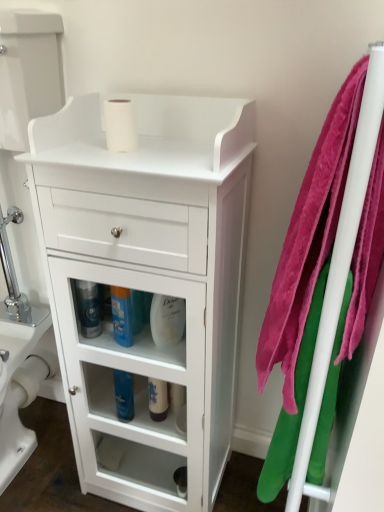
Measure the distance between point (150, 397) and camera.

Point (150, 397) and camera are 4.09 feet apart.

What do you see at coordinates (121, 315) in the screenshot?
I see `blue glossy bottle at center, the 3th cleaning product when ordered from left to right` at bounding box center [121, 315].

Where is `translucent plastic bottle at lower left, the fifth cleaning product viewed from the right`? The image size is (384, 512). translucent plastic bottle at lower left, the fifth cleaning product viewed from the right is located at coordinates (88, 308).

This screenshot has width=384, height=512. What do you see at coordinates (19, 392) in the screenshot?
I see `white glossy toilet bowl at lower left` at bounding box center [19, 392].

Identify the location of white glossy toilet bowl at lower left. The height and width of the screenshot is (512, 384). (19, 392).

Find the location of a particular element. white glossy bottle at center, which is the 4th cleaning product from left to right is located at coordinates (158, 399).

From the image's perspective, is white glossy bottle at center, acting as the 5th cleaning product starting from the left, above or below translucent plastic bottle at lower left, which is counted as the first cleaning product, starting from the left?

Clearly, from the image's perspective, white glossy bottle at center, acting as the 5th cleaning product starting from the left, is below translucent plastic bottle at lower left, which is counted as the first cleaning product, starting from the left.

Is the position of white glossy bottle at center, positioned as the 1th cleaning product in right-to-left order, more distant than that of translucent plastic bottle at lower left, the fifth cleaning product viewed from the right?

That is False.

Is white glossy bottle at center, positioned as the 1th cleaning product in right-to-left order, positioned beyond the bounds of translucent plastic bottle at lower left, which is counted as the first cleaning product, starting from the left?

Absolutely, white glossy bottle at center, positioned as the 1th cleaning product in right-to-left order, is external to translucent plastic bottle at lower left, which is counted as the first cleaning product, starting from the left.

Does white glossy bottle at center, positioned as the 1th cleaning product in right-to-left order, have a greater height compared to translucent plastic bottle at lower left, the fifth cleaning product viewed from the right?

Correct, white glossy bottle at center, positioned as the 1th cleaning product in right-to-left order, is much taller as translucent plastic bottle at lower left, the fifth cleaning product viewed from the right.

Is point (133, 135) farther from viewer compared to point (120, 315)?

That is False.

At what (x,y) coordinates should I click in order to perform the action: click on toilet paper on the right of blue glossy bottle at center, which is counted as the 3th cleaning product, starting from the right. Please return your answer as a coordinate pair (x, y). The image size is (384, 512). Looking at the image, I should click on (120, 125).

Who is shorter, white matte toilet paper at upper center, which ranks as the 2th toilet paper in left-to-right order, or blue glossy bottle at center, which is counted as the 3th cleaning product, starting from the right?

With less height is white matte toilet paper at upper center, which ranks as the 2th toilet paper in left-to-right order.

Based on their positions, is white matte toilet paper at upper center, which appears as the 1th toilet paper when viewed from the right, located to the left or right of blue glossy bottle at center, the 3th cleaning product when ordered from left to right?

In the image, white matte toilet paper at upper center, which appears as the 1th toilet paper when viewed from the right, appears on the right side of blue glossy bottle at center, the 3th cleaning product when ordered from left to right.

Between blue glossy bottle at center, the 3th cleaning product when ordered from left to right, and white glossy toilet bowl at lower left, which one has smaller width?

With smaller width is blue glossy bottle at center, the 3th cleaning product when ordered from left to right.

Would you say white glossy toilet bowl at lower left is part of blue glossy bottle at center, which is counted as the 3th cleaning product, starting from the right,'s contents?

No, white glossy toilet bowl at lower left is located outside of blue glossy bottle at center, which is counted as the 3th cleaning product, starting from the right.

From a real-world perspective, who is located higher, blue glossy bottle at center, which is counted as the 3th cleaning product, starting from the right, or white glossy toilet bowl at lower left?

blue glossy bottle at center, which is counted as the 3th cleaning product, starting from the right.

Based on the photo, is blue glossy bottle at center, which is counted as the 3th cleaning product, starting from the right, aimed at white glossy toilet bowl at lower left?

No.

Is blue glossy bottle at lower center, which ranks as the 4th cleaning product in right-to-left order, positioned far away from white glossy toilet bowl at lower left?

Actually, blue glossy bottle at lower center, which ranks as the 4th cleaning product in right-to-left order, and white glossy toilet bowl at lower left are a little close together.

Does blue glossy bottle at lower center, the second cleaning product positioned from the left, have a greater height compared to white glossy toilet bowl at lower left?

No.

Considering the relative positions of blue glossy bottle at lower center, the second cleaning product positioned from the left, and white glossy toilet bowl at lower left in the image provided, is blue glossy bottle at lower center, the second cleaning product positioned from the left, to the left of white glossy toilet bowl at lower left from the viewer's perspective?

No.

Looking at this image, from the image's perspective, which one is positioned higher, blue glossy bottle at lower center, which ranks as the 4th cleaning product in right-to-left order, or white glossy toilet bowl at lower left?

From the image's view, blue glossy bottle at lower center, which ranks as the 4th cleaning product in right-to-left order, is above.

Considering the sizes of objects pink plush towel at right, the first bath towel viewed from the right, and white glossy bottle at center, positioned as the 1th cleaning product in right-to-left order, in the image provided, who is wider, pink plush towel at right, the first bath towel viewed from the right, or white glossy bottle at center, positioned as the 1th cleaning product in right-to-left order,?

pink plush towel at right, the first bath towel viewed from the right, is wider.

From a real-world perspective, between pink plush towel at right, the first bath towel viewed from the right, and white glossy bottle at center, positioned as the 1th cleaning product in right-to-left order, who is vertically higher?

pink plush towel at right, the first bath towel viewed from the right.

Is pink plush towel at right, which is the 2th bath towel in left-to-right order, to the right of white glossy bottle at center, acting as the 5th cleaning product starting from the left, from the viewer's perspective?

Yes, pink plush towel at right, which is the 2th bath towel in left-to-right order, is to the right of white glossy bottle at center, acting as the 5th cleaning product starting from the left.

Which of these two, blue glossy bottle at center, which is counted as the 3th cleaning product, starting from the right, or white glossy bottle at center, which is the 4th cleaning product from left to right, is thinner?

Thinner between the two is white glossy bottle at center, which is the 4th cleaning product from left to right.

Does blue glossy bottle at center, the 3th cleaning product when ordered from left to right, come in front of white glossy bottle at center, the second cleaning product positioned from the right?

Yes, blue glossy bottle at center, the 3th cleaning product when ordered from left to right, is closer to the viewer.

Consider the image. Is blue glossy bottle at center, the 3th cleaning product when ordered from left to right, oriented towards white glossy bottle at center, the second cleaning product positioned from the right?

No, blue glossy bottle at center, the 3th cleaning product when ordered from left to right, is not turned towards white glossy bottle at center, the second cleaning product positioned from the right.

Based on the photo, considering the relative sizes of velvety pink towel at right, which is counted as the second bath towel, starting from the right, and blue glossy bottle at center, which is counted as the 3th cleaning product, starting from the right, in the image provided, is velvety pink towel at right, which is counted as the second bath towel, starting from the right, smaller than blue glossy bottle at center, which is counted as the 3th cleaning product, starting from the right,?

No, velvety pink towel at right, which is counted as the second bath towel, starting from the right, is not smaller than blue glossy bottle at center, which is counted as the 3th cleaning product, starting from the right.

Could you tell me if velvety pink towel at right, which is counted as the second bath towel, starting from the right, is turned towards blue glossy bottle at center, which is counted as the 3th cleaning product, starting from the right?

Yes.

Based on the photo, is velvety pink towel at right, which is counted as the second bath towel, starting from the right, positioned before blue glossy bottle at center, which is counted as the 3th cleaning product, starting from the right?

That is True.

From the image's perspective, between velvety pink towel at right, which is counted as the second bath towel, starting from the right, and blue glossy bottle at center, which is counted as the 3th cleaning product, starting from the right, which one is located above?

blue glossy bottle at center, which is counted as the 3th cleaning product, starting from the right, is shown above in the image.

Locate an element on the screen. The height and width of the screenshot is (512, 384). cleaning product that is above the white glossy bottle at center, acting as the 5th cleaning product starting from the left (from the image's perspective) is located at coordinates (88, 308).

Locate an element on the screen. The height and width of the screenshot is (512, 384). the 2nd cleaning product behind when counting from the white matte toilet paper at upper center, which appears as the 1th toilet paper when viewed from the right is located at coordinates (121, 315).

When comparing their distances from white glossy bottle at center, acting as the 5th cleaning product starting from the left, does blue glossy bottle at center, which is counted as the 3th cleaning product, starting from the right, or white glossy bottle at center, which is the 4th cleaning product from left to right, seem further?

white glossy bottle at center, which is the 4th cleaning product from left to right, lies further to white glossy bottle at center, acting as the 5th cleaning product starting from the left, than the other object.

From the image, which object appears to be farther from blue glossy bottle at lower center, which ranks as the 4th cleaning product in right-to-left order, white glossy bottle at center, which is the 4th cleaning product from left to right, or velvety pink towel at right, which is counted as the second bath towel, starting from the right?

Based on the image, velvety pink towel at right, which is counted as the second bath towel, starting from the right, appears to be further to blue glossy bottle at lower center, which ranks as the 4th cleaning product in right-to-left order.

Which object lies further to the anchor point translucent plastic bottle at lower left, which is counted as the first cleaning product, starting from the left, blue glossy bottle at lower center, the second cleaning product positioned from the left, or white matte toilet paper at lower center, acting as the second toilet paper starting from the right?

Among the two, white matte toilet paper at lower center, acting as the second toilet paper starting from the right, is located further to translucent plastic bottle at lower left, which is counted as the first cleaning product, starting from the left.

From the picture: Looking at the image, which one is located closer to translucent plastic bottle at lower left, which is counted as the first cleaning product, starting from the left, pink plush towel at right, which is the 2th bath towel in left-to-right order, or white matte toilet paper at upper center, which appears as the 1th toilet paper when viewed from the right?

white matte toilet paper at upper center, which appears as the 1th toilet paper when viewed from the right, lies closer to translucent plastic bottle at lower left, which is counted as the first cleaning product, starting from the left, than the other object.

Considering their positions, is white matte toilet paper at upper center, marked as the 1th toilet paper in a top-to-bottom arrangement, positioned further to translucent plastic bottle at lower left, the fifth cleaning product viewed from the right, than white matte toilet paper at lower center, arranged as the second toilet paper when viewed from the front?

white matte toilet paper at lower center, arranged as the second toilet paper when viewed from the front.

Looking at the image, which one is located further to white glossy toilet bowl at lower left, blue glossy bottle at lower center, the second cleaning product positioned from the left, or translucent plastic bottle at lower left, which is counted as the first cleaning product, starting from the left?

translucent plastic bottle at lower left, which is counted as the first cleaning product, starting from the left.

Based on their spatial positions, is translucent plastic bottle at lower left, which is counted as the first cleaning product, starting from the left, or pink plush towel at right, which is the 2th bath towel in left-to-right order, closer to white glossy bottle at center, which is the 4th cleaning product from left to right?

The object closer to white glossy bottle at center, which is the 4th cleaning product from left to right, is translucent plastic bottle at lower left, which is counted as the first cleaning product, starting from the left.

Looking at the image, which one is located closer to blue glossy bottle at center, the 3th cleaning product when ordered from left to right, white glossy bottle at center, positioned as the 1th cleaning product in right-to-left order, or blue glossy bottle at lower center, which ranks as the 4th cleaning product in right-to-left order?

Based on the image, white glossy bottle at center, positioned as the 1th cleaning product in right-to-left order, appears to be nearer to blue glossy bottle at center, the 3th cleaning product when ordered from left to right.

The width and height of the screenshot is (384, 512). What are the coordinates of `chest of drawers between white matte toilet paper at upper center, the 2th toilet paper viewed from the back, and velvety pink towel at right, which is counted as the second bath towel, starting from the right, in the vertical direction` in the screenshot? It's located at (147, 280).

This screenshot has width=384, height=512. I want to click on toilet paper between blue glossy bottle at center, which is counted as the 3th cleaning product, starting from the right, and pink plush towel at right, which is the 2th bath towel in left-to-right order, so click(120, 125).

Where is `chest of drawers between white matte toilet paper at upper center, arranged as the first toilet paper when viewed from the front, and pink plush towel at right, the first bath towel viewed from the right`? The image size is (384, 512). chest of drawers between white matte toilet paper at upper center, arranged as the first toilet paper when viewed from the front, and pink plush towel at right, the first bath towel viewed from the right is located at coordinates (147, 280).

The width and height of the screenshot is (384, 512). Find the location of `the chest of drawers positioned between pink plush towel at right, which is the 2th bath towel in left-to-right order, and white glossy bottle at center, the second cleaning product positioned from the right, from near to far`. the chest of drawers positioned between pink plush towel at right, which is the 2th bath towel in left-to-right order, and white glossy bottle at center, the second cleaning product positioned from the right, from near to far is located at coordinates point(147,280).